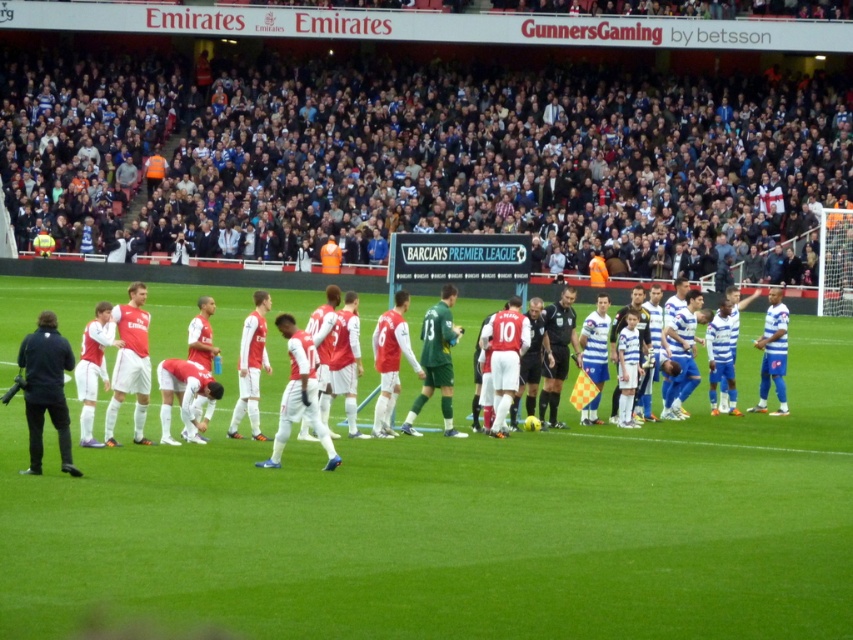
Question: Which of these objects is positioned farthest from the green grass field at center?

Choices:
 (A) black uniformed official at center
 (B) dark blue jersey at upper center
 (C) matte white soccer team at center
 (D) green jersey at center

Answer: (B)

Question: Which point appears closest to the camera in this image?

Choices:
 (A) (450, 294)
 (B) (669, 104)
 (C) (561, 372)

Answer: (A)

Question: Can you confirm if green grass field at center is thinner than green jersey at center?

Choices:
 (A) yes
 (B) no

Answer: (B)

Question: Is green grass field at center to the right of green jersey at center from the viewer's perspective?

Choices:
 (A) yes
 (B) no

Answer: (B)

Question: Which object is the closest to the matte white soccer team at center?

Choices:
 (A) green grass field at center
 (B) dark blue jersey at upper center

Answer: (A)

Question: Does green grass field at center appear under dark blue jersey at upper center?

Choices:
 (A) yes
 (B) no

Answer: (A)